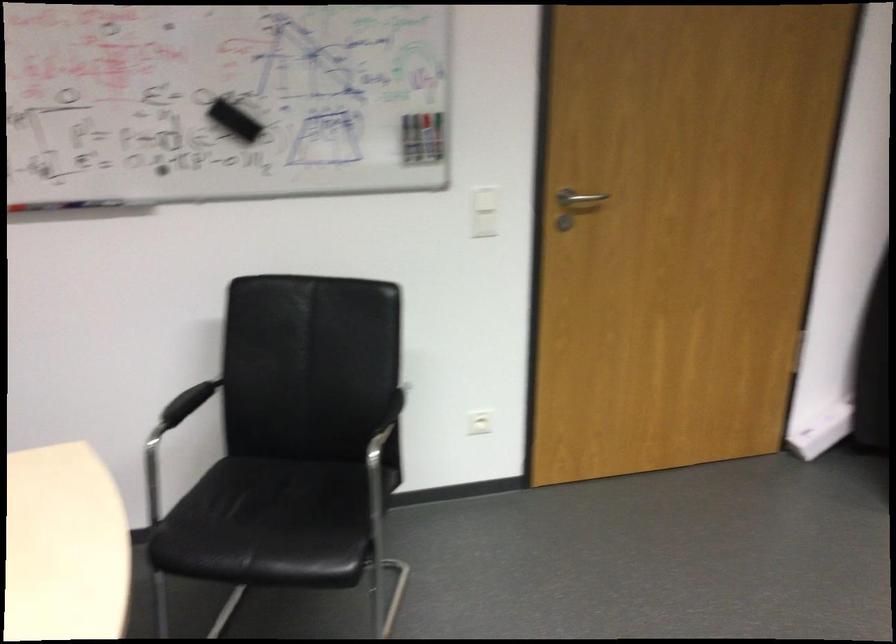
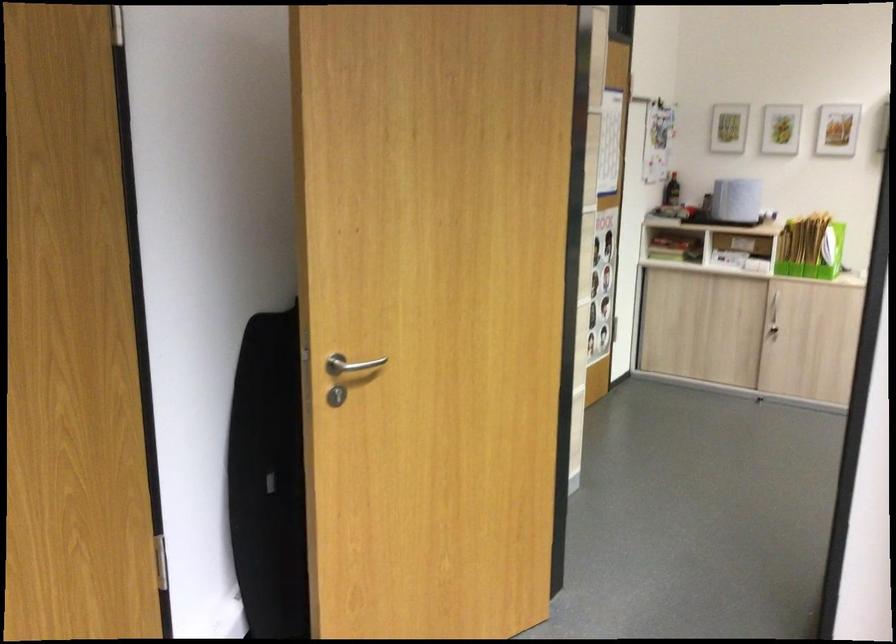
Question: The camera is either moving clockwise (left) or counter-clockwise (right) around the object. The first image is from the beginning of the video and the second image is from the end. Is the camera moving left or right when shooting the video?

Choices:
 (A) Left
 (B) Right

Answer: (A)